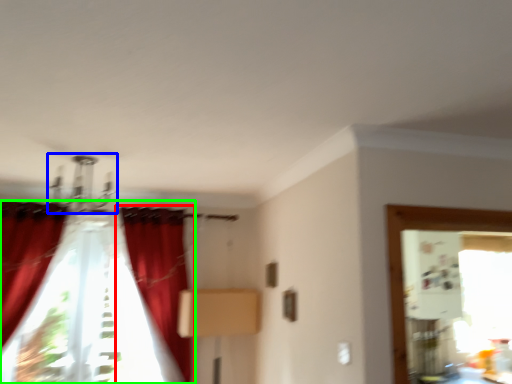
Question: Which object is the farthest from curtain (highlighted by a red box)? Choose among these: light fixture (highlighted by a blue box) or curtain (highlighted by a green box).

Choices:
 (A) light fixture
 (B) curtain

Answer: (A)